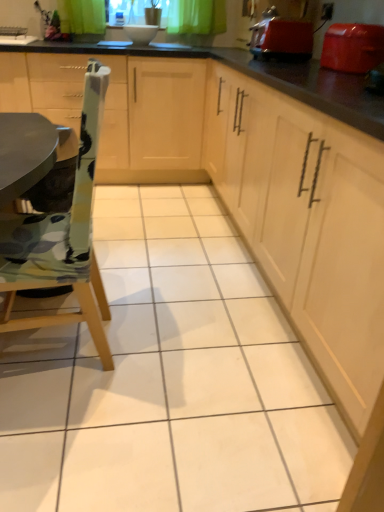
Question: From a real-world perspective, does wooden chair at left stand above shiny plastic toaster at upper right, the first appliance in the right-to-left sequence?

Choices:
 (A) no
 (B) yes

Answer: (A)

Question: Is wooden chair at left in front of shiny plastic toaster at upper right, the first appliance in the right-to-left sequence?

Choices:
 (A) no
 (B) yes

Answer: (B)

Question: Is wooden chair at left oriented away from shiny plastic toaster at upper right, which ranks as the 2th appliance in back-to-front order?

Choices:
 (A) yes
 (B) no

Answer: (A)

Question: Can you confirm if wooden chair at left is smaller than shiny plastic toaster at upper right, the first appliance in the right-to-left sequence?

Choices:
 (A) yes
 (B) no

Answer: (B)

Question: Can you confirm if wooden chair at left is thinner than shiny plastic toaster at upper right, which ranks as the 2th appliance in back-to-front order?

Choices:
 (A) yes
 (B) no

Answer: (B)

Question: Is matte red toaster at upper right, the second appliance when ordered from right to left, wider or thinner than matte wood cabinets at center, which is the 1th cabinetry in left-to-right order?

Choices:
 (A) wide
 (B) thin

Answer: (B)

Question: From a real-world perspective, is matte red toaster at upper right, the first appliance positioned from the left, physically located above or below matte wood cabinets at center, the second cabinetry in the right-to-left sequence?

Choices:
 (A) below
 (B) above

Answer: (B)

Question: Which is correct: matte red toaster at upper right, the first appliance positioned from the left, is inside matte wood cabinets at center, the second cabinetry in the right-to-left sequence, or outside of it?

Choices:
 (A) inside
 (B) outside

Answer: (B)

Question: From the image's perspective, is matte red toaster at upper right, the second appliance when ordered from right to left, located above or below matte wood cabinets at center, the second cabinetry in the right-to-left sequence?

Choices:
 (A) below
 (B) above

Answer: (B)

Question: Is light wood cabinet at center, placed as the 2th cabinetry when sorted from left to right, taller or shorter than matte wood cabinets at center, the second cabinetry in the right-to-left sequence?

Choices:
 (A) tall
 (B) short

Answer: (B)

Question: In terms of width, does light wood cabinet at center, placed as the 2th cabinetry when sorted from left to right, look wider or thinner when compared to matte wood cabinets at center, which is the 1th cabinetry in left-to-right order?

Choices:
 (A) wide
 (B) thin

Answer: (A)

Question: Is point (213, 90) closer or farther from the camera than point (188, 155)?

Choices:
 (A) farther
 (B) closer

Answer: (B)

Question: Considering the positions of light wood cabinet at center, placed as the 2th cabinetry when sorted from left to right, and matte wood cabinets at center, which is the 1th cabinetry in left-to-right order, in the image, is light wood cabinet at center, placed as the 2th cabinetry when sorted from left to right, bigger or smaller than matte wood cabinets at center, which is the 1th cabinetry in left-to-right order,?

Choices:
 (A) big
 (B) small

Answer: (A)

Question: Would you say shiny plastic toaster at upper right, which ranks as the 2th appliance in back-to-front order, is inside or outside matte wood cabinets at center, the second cabinetry in the right-to-left sequence?

Choices:
 (A) inside
 (B) outside

Answer: (B)

Question: From the image's perspective, is shiny plastic toaster at upper right, the 2th appliance in the left-to-right sequence, positioned above or below matte wood cabinets at center, which is the 1th cabinetry in left-to-right order?

Choices:
 (A) above
 (B) below

Answer: (B)